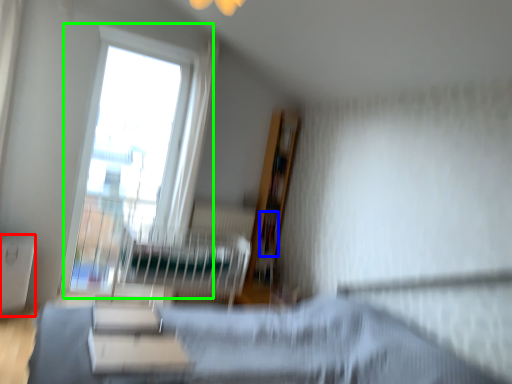
Question: Considering the real-world distances, which object is farthest from table (highlighted by a red box)? book (highlighted by a blue box) or window (highlighted by a green box)?

Choices:
 (A) book
 (B) window

Answer: (A)